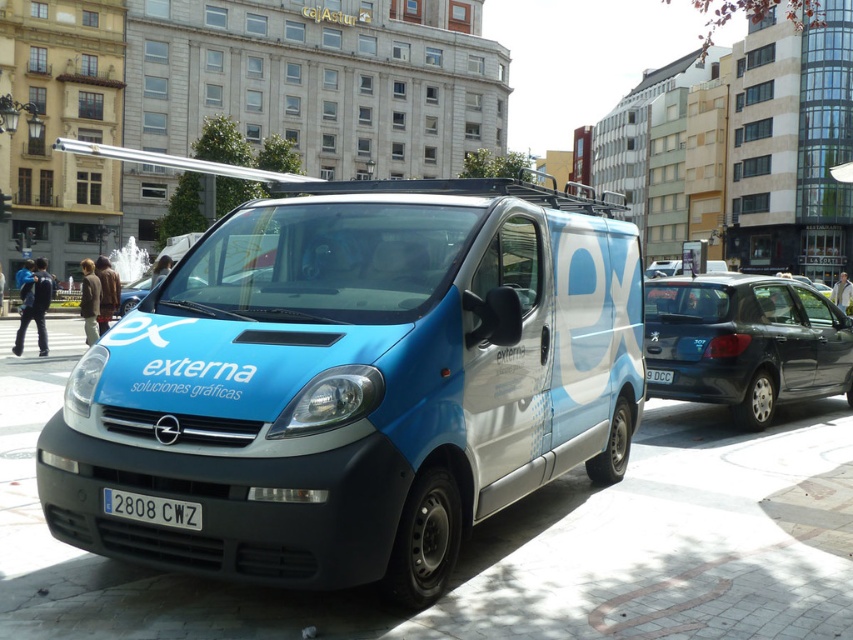
Question: Does blue metallic van at center have a greater width compared to black plastic license plate at center?

Choices:
 (A) no
 (B) yes

Answer: (B)

Question: Which object is the farthest from the black plastic license plate at center?

Choices:
 (A) white plastic license plate at center
 (B) glossy dark blue hatchback at right
 (C) blue concrete pavement at center

Answer: (B)

Question: Is glossy dark blue hatchback at right to the left of white plastic license plate at center from the viewer's perspective?

Choices:
 (A) no
 (B) yes

Answer: (A)

Question: Is blue metallic van at center further to camera compared to white plastic license plate at center?

Choices:
 (A) yes
 (B) no

Answer: (B)

Question: Which is farther from the white plastic license plate at center?

Choices:
 (A) blue metallic van at center
 (B) glossy dark blue hatchback at right
 (C) blue concrete pavement at center

Answer: (A)

Question: Which point is farther to the camera?

Choices:
 (A) (253, 477)
 (B) (144, 499)
 (C) (664, 374)
 (D) (751, 529)

Answer: (C)